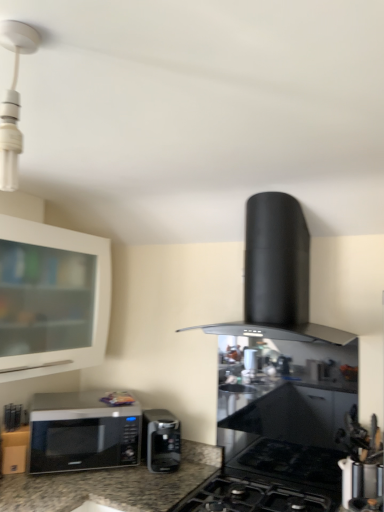
Question: Considering the relative sizes of metallic silver utensil holder at lower right and black matte gas stove at center in the image provided, is metallic silver utensil holder at lower right bigger than black matte gas stove at center?

Choices:
 (A) yes
 (B) no

Answer: (B)

Question: Does metallic silver utensil holder at lower right appear on the left side of black matte gas stove at center?

Choices:
 (A) no
 (B) yes

Answer: (A)

Question: From the image's perspective, is metallic silver utensil holder at lower right over black matte gas stove at center?

Choices:
 (A) yes
 (B) no

Answer: (A)

Question: Considering the relative positions of metallic silver utensil holder at lower right and black matte gas stove at center in the image provided, is metallic silver utensil holder at lower right to the right of black matte gas stove at center from the viewer's perspective?

Choices:
 (A) no
 (B) yes

Answer: (B)

Question: Is metallic silver utensil holder at lower right facing away from black matte gas stove at center?

Choices:
 (A) no
 (B) yes

Answer: (A)

Question: Is black matte range hood at center taller or shorter than black matte gas stove at center?

Choices:
 (A) tall
 (B) short

Answer: (A)

Question: Looking at their shapes, would you say black matte range hood at center is wider or thinner than black matte gas stove at center?

Choices:
 (A) wide
 (B) thin

Answer: (B)

Question: From a real-world perspective, relative to black matte gas stove at center, is black matte range hood at center vertically above or below?

Choices:
 (A) above
 (B) below

Answer: (A)

Question: Is black matte range hood at center spatially inside black matte gas stove at center, or outside of it?

Choices:
 (A) outside
 (B) inside

Answer: (A)

Question: Is white glossy cabinet at upper left inside or outside of white glossy light fixture at upper left?

Choices:
 (A) inside
 (B) outside

Answer: (B)

Question: From a real-world perspective, is white glossy cabinet at upper left physically located above or below white glossy light fixture at upper left?

Choices:
 (A) below
 (B) above

Answer: (A)

Question: In terms of height, does white glossy cabinet at upper left look taller or shorter compared to white glossy light fixture at upper left?

Choices:
 (A) short
 (B) tall

Answer: (B)

Question: From the image's perspective, is white glossy cabinet at upper left above or below white glossy light fixture at upper left?

Choices:
 (A) above
 (B) below

Answer: (B)

Question: From their relative heights in the image, would you say black matte range hood at center is taller or shorter than white glossy light fixture at upper left?

Choices:
 (A) tall
 (B) short

Answer: (A)

Question: From the image's perspective, is black matte range hood at center above or below white glossy light fixture at upper left?

Choices:
 (A) below
 (B) above

Answer: (A)